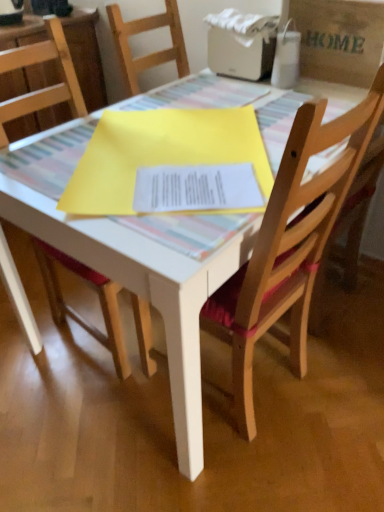
Question: Is wooden chair at center, which is the second chair in right-to-left order, wider or thinner than brown paper bag at upper right?

Choices:
 (A) thin
 (B) wide

Answer: (B)

Question: Is wooden chair at center, the first chair positioned from the left, bigger or smaller than brown paper bag at upper right?

Choices:
 (A) small
 (B) big

Answer: (B)

Question: Estimate the real-world distances between objects in this image. Which object is farther from the wooden chair with red cushion at center, the first chair from the right?

Choices:
 (A) white plastic printer at upper center
 (B) brown paper bag at upper right
 (C) wooden chair at center, which is the second chair in right-to-left order

Answer: (A)

Question: Which object is positioned farthest from the brown paper bag at upper right?

Choices:
 (A) white plastic printer at upper center
 (B) wooden chair with red cushion at center, the first chair from the right
 (C) wooden chair at center, which is the second chair in right-to-left order

Answer: (C)